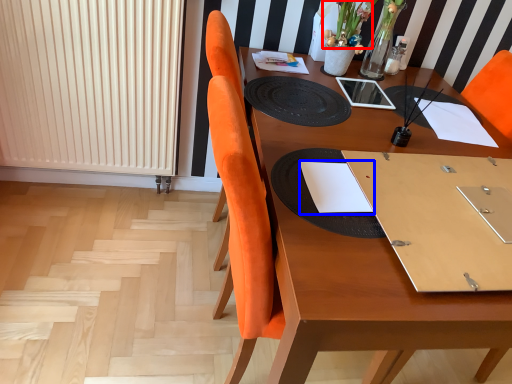
Question: Which object is further to the camera taking this photo, flower (highlighted by a red box) or notebook (highlighted by a blue box)?

Choices:
 (A) flower
 (B) notebook

Answer: (A)